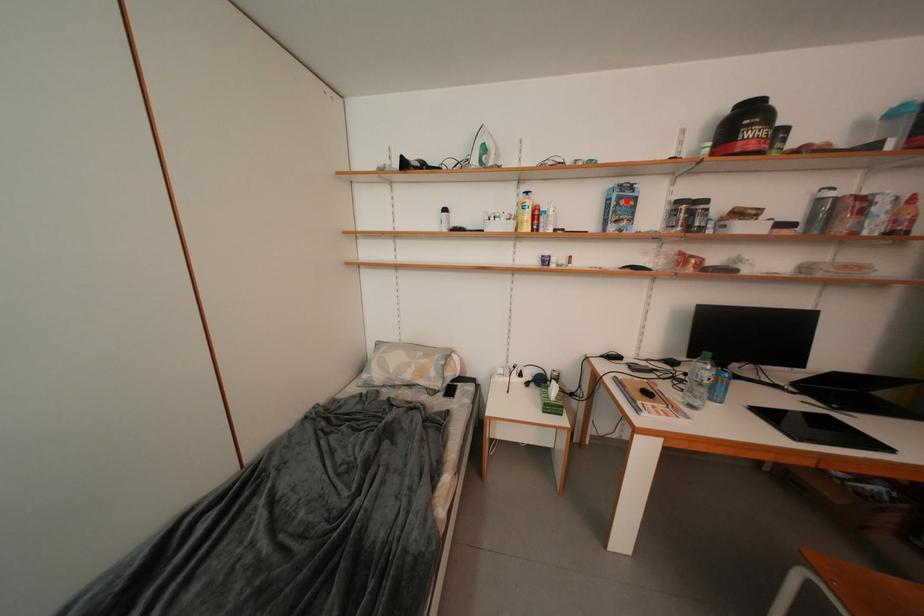
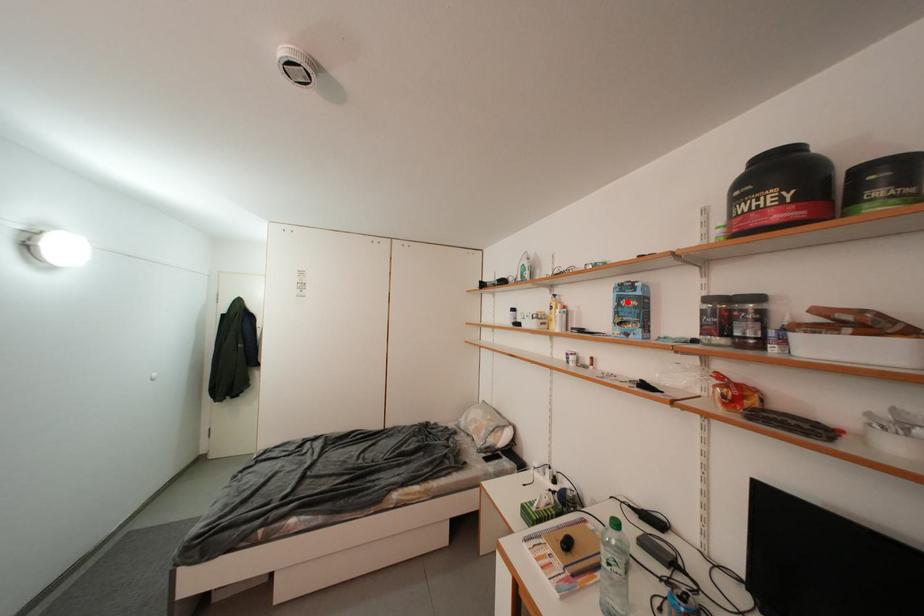
I am providing you with two images of the same scene from different viewpoints. A red point is marked on the first image and another point is marked on the second image. Does the point marked in image1 correspond to the same location as the one in image2?

Yes